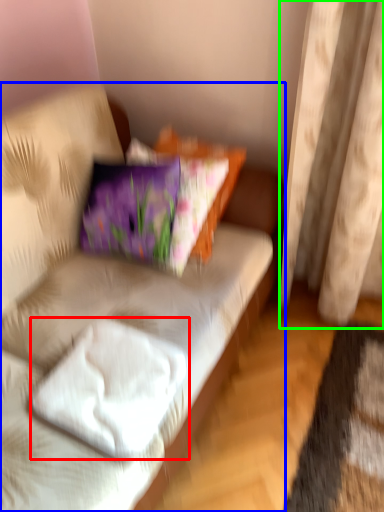
Question: Which object is the farthest from pillow (highlighted by a red box)? Choose among these: studio couch (highlighted by a blue box) or curtain (highlighted by a green box).

Choices:
 (A) studio couch
 (B) curtain

Answer: (B)